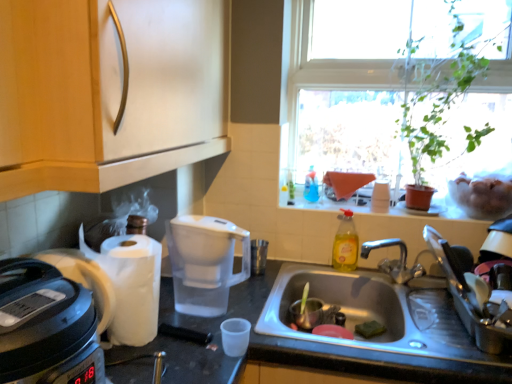
Question: Does metallic sink at lower center lie in front of transparent glass window at upper right?

Choices:
 (A) no
 (B) yes

Answer: (B)

Question: From the image's perspective, does metallic sink at lower center appear lower than transparent glass window at upper right?

Choices:
 (A) no
 (B) yes

Answer: (B)

Question: Is metallic sink at lower center at the right side of transparent glass window at upper right?

Choices:
 (A) yes
 (B) no

Answer: (B)

Question: Can you confirm if metallic sink at lower center is thinner than transparent glass window at upper right?

Choices:
 (A) no
 (B) yes

Answer: (A)

Question: Is metallic sink at lower center located outside transparent glass window at upper right?

Choices:
 (A) no
 (B) yes

Answer: (B)

Question: Would you say stainless steel sink at lower center is inside or outside white plastic rice cooker at left?

Choices:
 (A) outside
 (B) inside

Answer: (A)

Question: Considering the positions of stainless steel sink at lower center and white plastic rice cooker at left in the image, is stainless steel sink at lower center wider or thinner than white plastic rice cooker at left?

Choices:
 (A) wide
 (B) thin

Answer: (A)

Question: Considering the positions of point (386, 304) and point (6, 339), is point (386, 304) closer or farther from the camera than point (6, 339)?

Choices:
 (A) farther
 (B) closer

Answer: (A)

Question: Would you say stainless steel sink at lower center is to the left or to the right of white plastic rice cooker at left in the picture?

Choices:
 (A) left
 (B) right

Answer: (B)

Question: From a real-world perspective, is metallic sink at lower center above or below transparent plastic water filter at center?

Choices:
 (A) below
 (B) above

Answer: (A)

Question: Considering the positions of metallic sink at lower center and transparent plastic water filter at center in the image, is metallic sink at lower center wider or thinner than transparent plastic water filter at center?

Choices:
 (A) thin
 (B) wide

Answer: (B)

Question: Based on their sizes in the image, would you say metallic sink at lower center is bigger or smaller than transparent plastic water filter at center?

Choices:
 (A) small
 (B) big

Answer: (B)

Question: Is metallic sink at lower center taller or shorter than transparent plastic water filter at center?

Choices:
 (A) tall
 (B) short

Answer: (A)

Question: From the image's perspective, is transparent plastic water filter at center above or below metallic sink at lower center?

Choices:
 (A) above
 (B) below

Answer: (A)

Question: From a real-world perspective, relative to metallic sink at lower center, is transparent plastic water filter at center vertically above or below?

Choices:
 (A) above
 (B) below

Answer: (A)